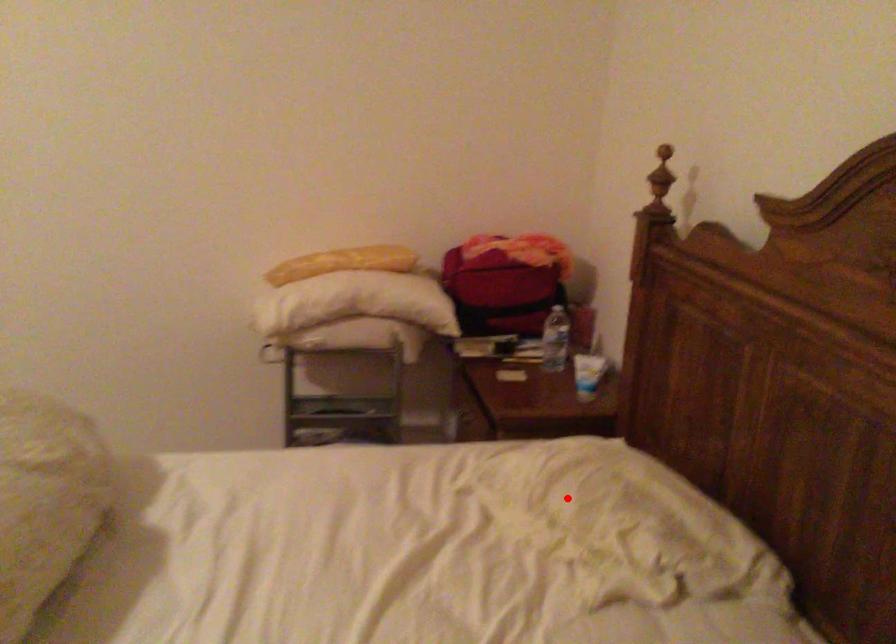
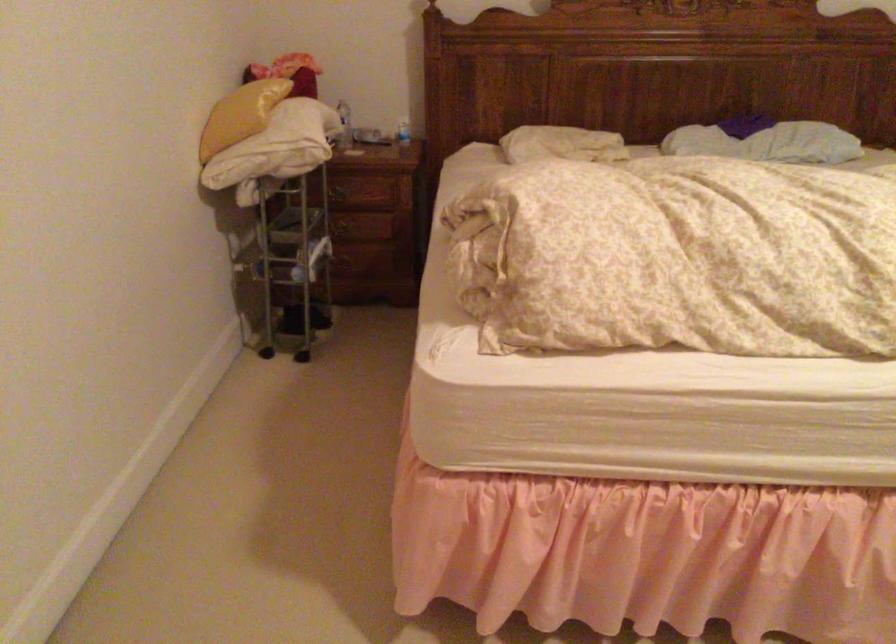
Where in the second image is the point corresponding to the highlighted location from the first image?

(561, 144)